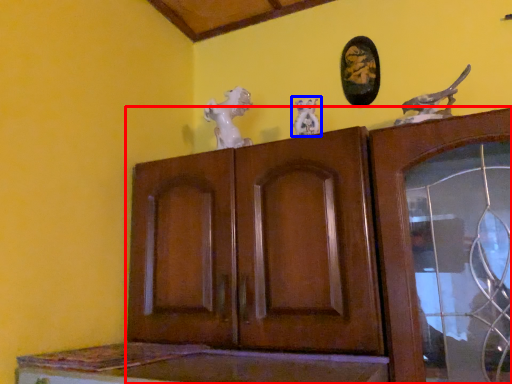
Question: Which of the following is the closest to the observer, cupboard (highlighted by a red box) or animal sculpture (highlighted by a blue box)?

Choices:
 (A) cupboard
 (B) animal sculpture

Answer: (A)